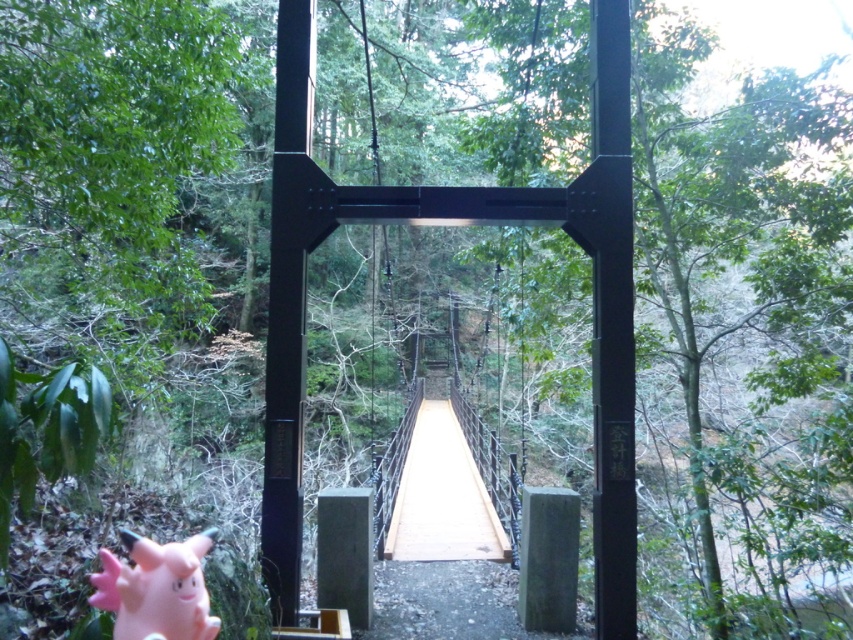
Who is lower down, black metal suspension bridge at center or wooden bridge at center?

wooden bridge at center

Which is above, black metal suspension bridge at center or wooden bridge at center?

black metal suspension bridge at center is above.

This screenshot has width=853, height=640. I want to click on black metal suspension bridge at center, so click(x=467, y=221).

Between point (270, 397) and point (167, 627), which one is positioned in front?

Positioned in front is point (167, 627).

Which is above, black metal suspension bridge at center or pink rubber toy at lower left?

black metal suspension bridge at center

At what (x,y) coordinates should I click in order to perform the action: click on black metal suspension bridge at center. Please return your answer as a coordinate pair (x, y). This screenshot has height=640, width=853. Looking at the image, I should click on (467, 221).

The width and height of the screenshot is (853, 640). In order to click on black metal suspension bridge at center in this screenshot , I will do `click(467, 221)`.

Is wooden bridge at center wider than pink rubber toy at lower left?

Yes, wooden bridge at center is wider than pink rubber toy at lower left.

Is point (479, 472) in front of point (151, 540)?

No.

Describe the element at coordinates (444, 497) in the screenshot. The height and width of the screenshot is (640, 853). I see `wooden bridge at center` at that location.

In order to click on wooden bridge at center in this screenshot , I will do `click(444, 497)`.